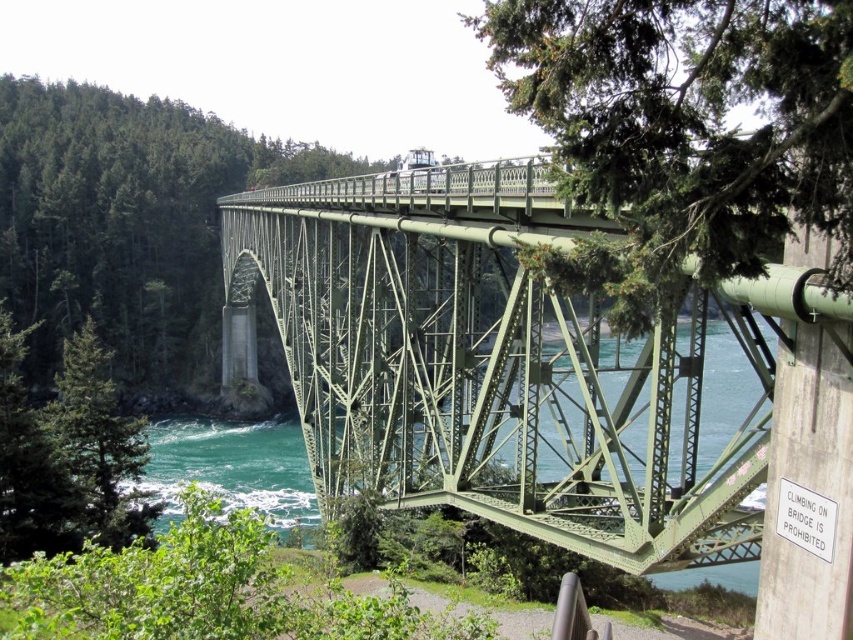
You are a photographer standing on the green painted steel bridge at center. You want to take a photo of the green textured tree at upper right. Is the tree visible from your current position on the bridge?

The green painted steel bridge at center is above the green textured tree at upper right, so the tree is positioned below the bridge. Since you are standing on the bridge, you can look down to see the tree below.

You are standing on the steel truss bridge and want to determine which of the two points, point (543, 65) or point (97, 356), is nearer to you. Based on the bridge structure, which point is closer?

Point (543, 65) is closer to the viewer than point (97, 356).

In the scene shown: You are standing on the steel truss bridge and looking towards the upper right corner of the bridge. Where exactly can you find the green textured tree at upper right?

The green textured tree at upper right is located at point (683, 131).